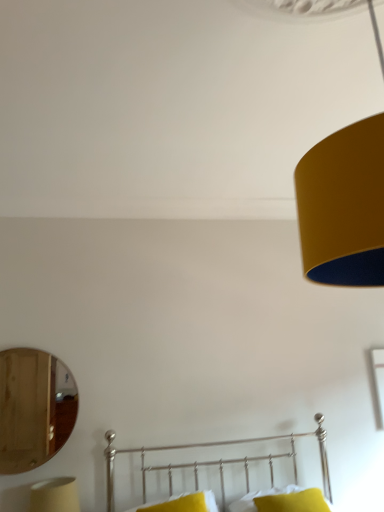
This screenshot has height=512, width=384. In order to click on matte yellow lampshade at lower left in this screenshot , I will do `click(54, 495)`.

I want to click on yellow fabric pillow at lower center, placed as the first pillow when sorted from right to left, so click(x=293, y=502).

Locate an element on the screen. wooden mirror at left is located at coordinates (31, 410).

Locate an element on the screen. This screenshot has width=384, height=512. metallic silver bed at lower center is located at coordinates (218, 461).

Measure the distance between point (180,503) and camera.

The depth of point (180,503) is 2.84 meters.

Identify the location of matte yellow lampshade at lower left. (54, 495).

Which of these two, matte yellow lampshade at lower left or yellow fabric pillow at lower center, which is the second pillow in right-to-left order, stands taller?

Standing taller between the two is matte yellow lampshade at lower left.

From a real-world perspective, is matte yellow lampshade at lower left physically located above or below yellow fabric pillow at lower center, which appears as the first pillow when viewed from the left?

Clearly, from a real-world perspective, matte yellow lampshade at lower left is above yellow fabric pillow at lower center, which appears as the first pillow when viewed from the left.

The width and height of the screenshot is (384, 512). Find the location of `bedside lamp that appears above the yellow fabric pillow at lower center, which is the second pillow in right-to-left order (from the image's perspective)`. bedside lamp that appears above the yellow fabric pillow at lower center, which is the second pillow in right-to-left order (from the image's perspective) is located at coordinates (54, 495).

Is yellow fabric pillow at lower center, which appears as the first pillow when viewed from the left, located within matte yellow lampshade at lower left?

Actually, yellow fabric pillow at lower center, which appears as the first pillow when viewed from the left, is outside matte yellow lampshade at lower left.

Who is taller, metallic silver bed at lower center or matte yellow lampshade at lower left?

→ metallic silver bed at lower center is taller.

Is metallic silver bed at lower center not inside matte yellow lampshade at lower left?

That's correct, metallic silver bed at lower center is outside of matte yellow lampshade at lower left.

Consider the image. Considering the positions of objects metallic silver bed at lower center and matte yellow lampshade at lower left in the image provided, who is more to the right, metallic silver bed at lower center or matte yellow lampshade at lower left?

metallic silver bed at lower center.

Would you say wooden mirror at left is inside or outside matte yellow lampshade at lower left?

wooden mirror at left lies outside matte yellow lampshade at lower left.

Is wooden mirror at left thinner than matte yellow lampshade at lower left?

Indeed, wooden mirror at left has a lesser width compared to matte yellow lampshade at lower left.

Between point (41, 368) and point (34, 495), which one is positioned in front?

Point (34, 495)

Is wooden mirror at left positioned with its back to matte yellow lampshade at lower left?

No, wooden mirror at left is not facing the opposite direction of matte yellow lampshade at lower left.

Looking at this image, is yellow fabric pillow at lower center, which appears as the first pillow when viewed from the left, beside wooden mirror at left?

No, yellow fabric pillow at lower center, which appears as the first pillow when viewed from the left, is not making contact with wooden mirror at left.

From the image's perspective, is yellow fabric pillow at lower center, which is the second pillow in right-to-left order, above or below wooden mirror at left?

yellow fabric pillow at lower center, which is the second pillow in right-to-left order, is below wooden mirror at left.

From a real-world perspective, which object stands above the other?

From a 3D spatial view, wooden mirror at left is above.

Is wooden mirror at left oriented towards metallic silver bed at lower center?

No, wooden mirror at left is not facing towards metallic silver bed at lower center.

Could metallic silver bed at lower center be considered to be inside wooden mirror at left?

No, metallic silver bed at lower center is not inside wooden mirror at left.

Considering the relative sizes of wooden mirror at left and metallic silver bed at lower center in the image provided, is wooden mirror at left bigger than metallic silver bed at lower center?

Incorrect, wooden mirror at left is not larger than metallic silver bed at lower center.

Is point (31, 351) positioned behind point (143, 463)?

Yes, point (31, 351) is farther from viewer.

Looking at this image, how much distance is there between metallic silver bed at lower center and yellow fabric pillow at lower center, positioned as the second pillow in left-to-right order?

metallic silver bed at lower center and yellow fabric pillow at lower center, positioned as the second pillow in left-to-right order, are 20.48 inches apart from each other.

Which of these two, metallic silver bed at lower center or yellow fabric pillow at lower center, placed as the first pillow when sorted from right to left, stands shorter?

yellow fabric pillow at lower center, placed as the first pillow when sorted from right to left, is shorter.

Is metallic silver bed at lower center further to the viewer compared to yellow fabric pillow at lower center, placed as the first pillow when sorted from right to left?

No, it is in front of yellow fabric pillow at lower center, placed as the first pillow when sorted from right to left.

Can you confirm if metallic silver bed at lower center is bigger than yellow fabric pillow at lower center, positioned as the second pillow in left-to-right order?

Correct, metallic silver bed at lower center is larger in size than yellow fabric pillow at lower center, positioned as the second pillow in left-to-right order.

From the image's perspective, which one is positioned higher, wooden mirror at left or yellow fabric pillow at lower center, which appears as the first pillow when viewed from the left?

wooden mirror at left.

Between wooden mirror at left and yellow fabric pillow at lower center, which appears as the first pillow when viewed from the left, which one has larger size?

wooden mirror at left.

Which point is more forward, (76, 392) or (210, 496)?

The point (210, 496) is closer.

From a real-world perspective, is wooden mirror at left physically below yellow fabric pillow at lower center, which appears as the first pillow when viewed from the left?

No.

At what (x,y) coordinates should I click in order to perform the action: click on bedside lamp above the yellow fabric pillow at lower center, which is the second pillow in right-to-left order (from the image's perspective). Please return your answer as a coordinate pair (x, y). Image resolution: width=384 pixels, height=512 pixels. Looking at the image, I should click on (54, 495).

This screenshot has height=512, width=384. I want to click on bedside lamp below the metallic silver bed at lower center (from the image's perspective), so click(x=54, y=495).

Based on their spatial positions, is yellow fabric pillow at lower center, which appears as the first pillow when viewed from the left, or matte yellow lampshade at lower left further from yellow fabric pillow at lower center, positioned as the second pillow in left-to-right order?

Among the two, matte yellow lampshade at lower left is located further to yellow fabric pillow at lower center, positioned as the second pillow in left-to-right order.

Looking at the image, which one is located closer to wooden mirror at left, matte yellow lampshade at lower left or yellow fabric pillow at lower center, which is the second pillow in right-to-left order?

The object closer to wooden mirror at left is matte yellow lampshade at lower left.

Based on their spatial positions, is matte yellow lampshade at lower left or yellow fabric pillow at lower center, placed as the first pillow when sorted from right to left, further from yellow fabric pillow at lower center, which appears as the first pillow when viewed from the left?

matte yellow lampshade at lower left lies further to yellow fabric pillow at lower center, which appears as the first pillow when viewed from the left, than the other object.

When comparing their distances from yellow fabric pillow at lower center, which appears as the first pillow when viewed from the left, does wooden mirror at left or metallic silver bed at lower center seem closer?

metallic silver bed at lower center is positioned closer to the anchor yellow fabric pillow at lower center, which appears as the first pillow when viewed from the left.

Based on their spatial positions, is metallic silver bed at lower center or yellow fabric pillow at lower center, placed as the first pillow when sorted from right to left, further from wooden mirror at left?

Among the two, yellow fabric pillow at lower center, placed as the first pillow when sorted from right to left, is located further to wooden mirror at left.

Estimate the real-world distances between objects in this image. Which object is closer to matte yellow lampshade at lower left, yellow fabric pillow at lower center, which appears as the first pillow when viewed from the left, or metallic silver bed at lower center?

metallic silver bed at lower center is closer to matte yellow lampshade at lower left.

When comparing their distances from yellow fabric pillow at lower center, positioned as the second pillow in left-to-right order, does matte yellow lampshade at lower left or yellow fabric pillow at lower center, which appears as the first pillow when viewed from the left, seem further?

matte yellow lampshade at lower left is positioned further to the anchor yellow fabric pillow at lower center, positioned as the second pillow in left-to-right order.

Considering their positions, is matte yellow lampshade at lower left positioned closer to yellow fabric pillow at lower center, which appears as the first pillow when viewed from the left, than metallic silver bed at lower center?

The object closer to yellow fabric pillow at lower center, which appears as the first pillow when viewed from the left, is metallic silver bed at lower center.

Find the location of `pillow between metallic silver bed at lower center and yellow fabric pillow at lower center, which is the second pillow in right-to-left order, along the z-axis`. pillow between metallic silver bed at lower center and yellow fabric pillow at lower center, which is the second pillow in right-to-left order, along the z-axis is located at coordinates (293, 502).

This screenshot has width=384, height=512. What are the coordinates of `pillow between matte yellow lampshade at lower left and yellow fabric pillow at lower center, placed as the first pillow when sorted from right to left, from left to right` in the screenshot? It's located at (185, 503).

Find the location of a particular element. This screenshot has height=512, width=384. bedside lamp positioned between metallic silver bed at lower center and yellow fabric pillow at lower center, which is the second pillow in right-to-left order, from near to far is located at coordinates (54, 495).

Where is `bedside lamp positioned between metallic silver bed at lower center and wooden mirror at left from near to far`? This screenshot has width=384, height=512. bedside lamp positioned between metallic silver bed at lower center and wooden mirror at left from near to far is located at coordinates (54, 495).